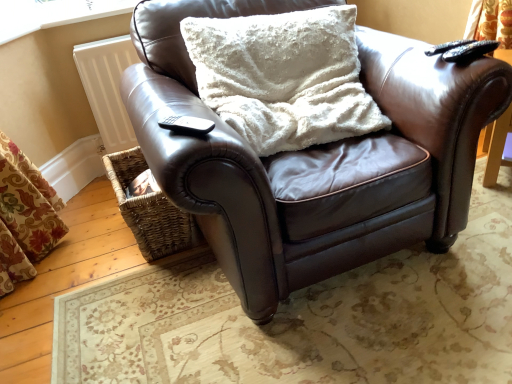
Question: Considering the relative positions of brown leather chair at center and black matte remote at upper right, acting as the second remote starting from the bottom, in the image provided, is brown leather chair at center to the left or to the right of black matte remote at upper right, acting as the second remote starting from the bottom,?

Choices:
 (A) left
 (B) right

Answer: (A)

Question: Looking at the image, does brown leather chair at center seem bigger or smaller compared to black matte remote at upper right, acting as the second remote starting from the bottom?

Choices:
 (A) big
 (B) small

Answer: (A)

Question: Considering the real-world distances, which object is closest to the black matte remote at upper right, arranged as the 1th remote when viewed from the back?

Choices:
 (A) woven brown basket at lower left
 (B) white painted wood at upper left
 (C) brown leather chair at center
 (D) white fluffy pillow at center
 (E) black plastic remote at lower left, placed as the 2th remote when sorted from right to left

Answer: (D)

Question: Which is nearer to the woven brown basket at lower left?

Choices:
 (A) brown leather chair at center
 (B) white fluffy pillow at center
 (C) black matte remote at upper right, the 1th remote from the right
 (D) white painted wood at upper left
 (E) black plastic remote at lower left, acting as the 1th remote starting from the bottom

Answer: (A)